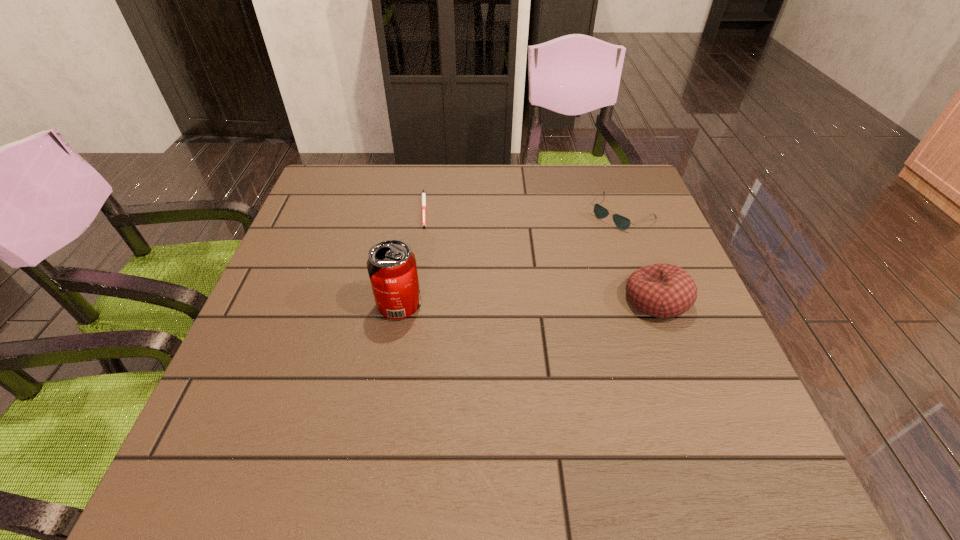
Locate an element on the screen. soda can is located at coordinates (391, 265).

You are a GUI agent. You are given a task and a screenshot of the screen. Output one action in this format:
    pyautogui.click(x=<x>, y=<y>)
    Task: Click on the second tallest object
    This screenshot has height=540, width=960.
    Given the screenshot: What is the action you would take?
    pyautogui.click(x=660, y=290)

Find the location of a particular element. sunglasses is located at coordinates point(623,223).

Where is `the shortest object`? The height and width of the screenshot is (540, 960). the shortest object is located at coordinates (423, 193).

Identify the location of free space located 0.090m on the left of the tallest object. (336, 305).

The image size is (960, 540). I want to click on free space located 0.220m on the back of the second tallest object, so click(x=626, y=219).

Where is `free space located on the lenses of the second shortest object`? The height and width of the screenshot is (540, 960). free space located on the lenses of the second shortest object is located at coordinates [543, 276].

Find the location of a particular element. This screenshot has height=540, width=960. free space located on the lenses of the second shortest object is located at coordinates 506,307.

At what (x,y) coordinates should I click in order to perform the action: click on free region located 0.350m on the lenses of the second shortest object. Please return your answer as a coordinate pair (x, y). Looking at the image, I should click on (516, 300).

Find the location of a particular element. This screenshot has width=960, height=540. free space located 0.300m on the clicker of the shortest object is located at coordinates (495, 292).